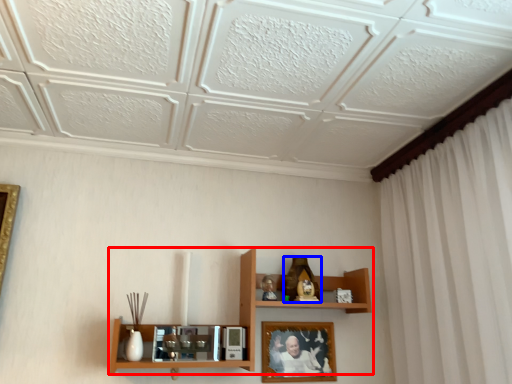
Question: Which object appears closest to the camera in this image, shelf (highlighted by a red box) or toy (highlighted by a blue box)?

Choices:
 (A) shelf
 (B) toy

Answer: (A)